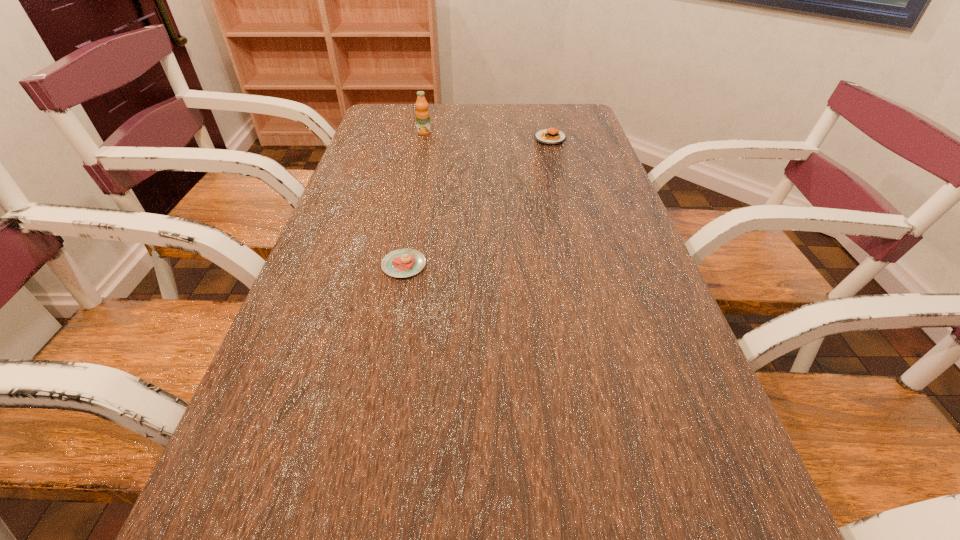
Image resolution: width=960 pixels, height=540 pixels. In order to click on vacant space in between the food and the tallest object in this screenshot , I will do `click(487, 136)`.

Locate an element on the screen. This screenshot has height=540, width=960. blank region between the orange juice and the nearest object is located at coordinates (414, 199).

In order to click on vacant space that's between the shortest object and the tallest object in this screenshot , I will do tap(414, 199).

Find the location of `vacant area that lies between the pastry and the tallest object`. vacant area that lies between the pastry and the tallest object is located at coordinates (414, 199).

At what (x,y) coordinates should I click in order to perform the action: click on free space between the second shortest object and the pastry. Please return your answer as a coordinate pair (x, y). Looking at the image, I should click on (477, 202).

The image size is (960, 540). Identify the location of unoccupied position between the orange juice and the rightmost object. (487, 136).

Where is `unoccupied position between the orange juice and the second shortest object`? unoccupied position between the orange juice and the second shortest object is located at coordinates (487, 136).

Where is `vacant space that's between the shortest object and the second shortest object`? The width and height of the screenshot is (960, 540). vacant space that's between the shortest object and the second shortest object is located at coordinates pos(477,202).

Locate an element on the screen. the second closest object relative to the orange juice is located at coordinates (400, 263).

Identify the location of object identified as the second closest to the nearest object. This screenshot has height=540, width=960. (551, 136).